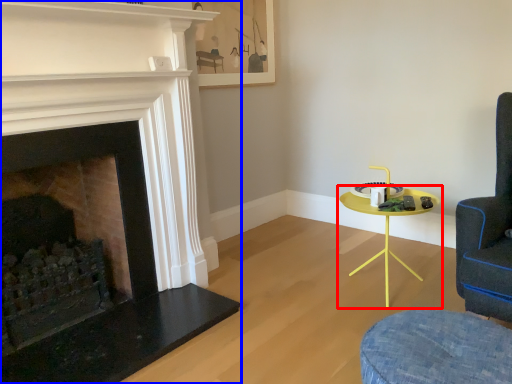
Question: Which object appears closest to the camera in this image, table (highlighted by a red box) or fireplace (highlighted by a blue box)?

Choices:
 (A) table
 (B) fireplace

Answer: (B)